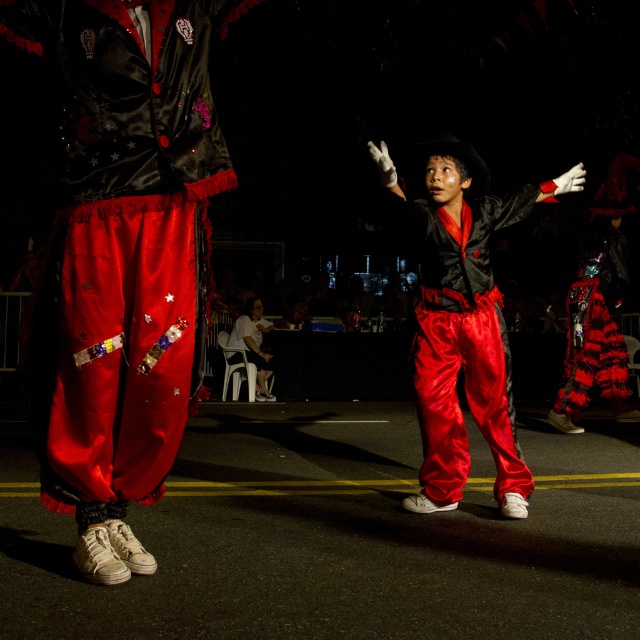
Question: Where is satin red pants at center located in relation to velvet-like red cape at center in the image?

Choices:
 (A) left
 (B) right

Answer: (A)

Question: From the image, what is the correct spatial relationship of velvet-like red cape at center in relation to white satin pants at center?

Choices:
 (A) left
 (B) right

Answer: (B)

Question: Among these points, which one is farthest from the camera?

Choices:
 (A) (17, 20)
 (B) (520, 472)

Answer: (B)

Question: Which object is positioned farthest from the shiny satin pants at center?

Choices:
 (A) velvet-like red cape at center
 (B) white satin pants at center
 (C) satin red pants at center

Answer: (B)

Question: Is shiny satin pants at center below white satin pants at center?

Choices:
 (A) no
 (B) yes

Answer: (A)

Question: Which object is closer to the camera taking this photo?

Choices:
 (A) velvet-like red cape at center
 (B) white satin pants at center
 (C) satin red pants at center

Answer: (C)